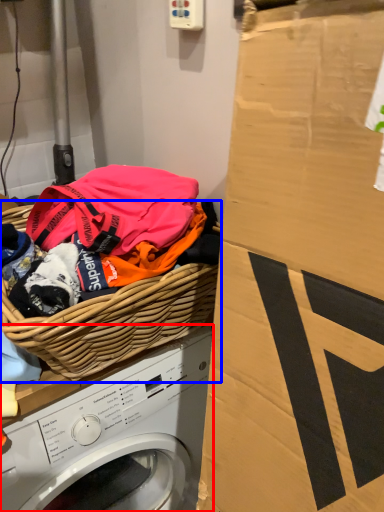
Question: Which object is further to the camera taking this photo, washing machine (highlighted by a red box) or basket (highlighted by a blue box)?

Choices:
 (A) washing machine
 (B) basket

Answer: (A)